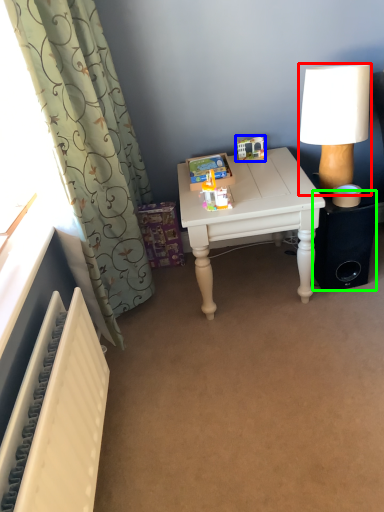
Question: Based on their relative distances, which object is farther from lamp (highlighted by a red box)? Choose from toy (highlighted by a blue box) and speaker (highlighted by a green box).

Choices:
 (A) toy
 (B) speaker

Answer: (A)